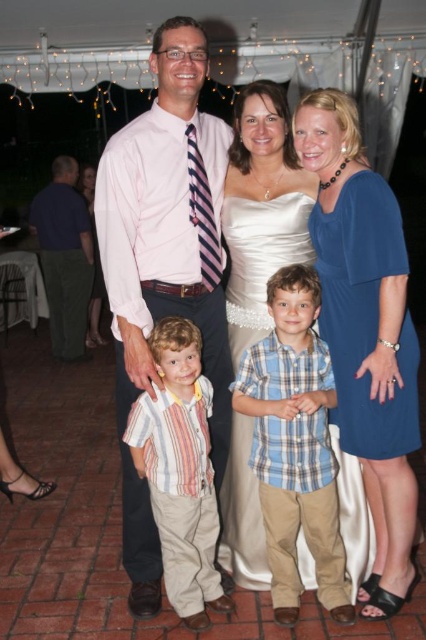
Looking at this image, does pink shirt at center have a greater width compared to blue plaid shirt at center?

Correct, the width of pink shirt at center exceeds that of blue plaid shirt at center.

Can you confirm if pink shirt at center is positioned to the left of blue plaid shirt at center?

Correct, you'll find pink shirt at center to the left of blue plaid shirt at center.

Locate an element on the screen. This screenshot has height=640, width=426. pink shirt at center is located at coordinates (164, 264).

Where is `pink shirt at center`? The width and height of the screenshot is (426, 640). pink shirt at center is located at coordinates (164, 264).

Who is higher up, satin dress at center or blue jersey dress at right?

satin dress at center is higher up.

Looking at this image, who is more distant from viewer, (276, 157) or (339, 358)?

Point (276, 157)

You are a GUI agent. You are given a task and a screenshot of the screen. Output one action in this format:
    pyautogui.click(x=<x>, y=<y>)
    Task: Click on the satin dress at center
    The width and height of the screenshot is (426, 640).
    Given the screenshot: What is the action you would take?
    coord(261,209)

Is point (339, 417) positioned behind point (267, 385)?

Yes, it is behind point (267, 385).

Is blue satin dress at center below blue plaid shirt at center?

No, blue satin dress at center is not below blue plaid shirt at center.

Image resolution: width=426 pixels, height=640 pixels. What do you see at coordinates (365, 332) in the screenshot? I see `blue satin dress at center` at bounding box center [365, 332].

The width and height of the screenshot is (426, 640). I want to click on blue satin dress at center, so click(x=365, y=332).